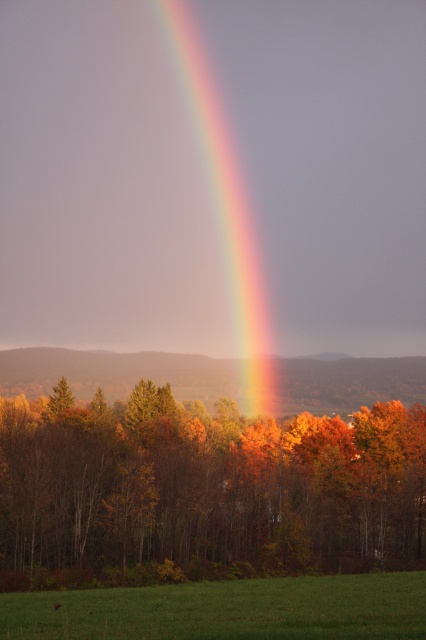
Is autumn leaves at center above rainbow at center?

Incorrect, autumn leaves at center is not positioned above rainbow at center.

Between point (414, 410) and point (210, 163), which one is positioned behind?

Point (210, 163)

Which is in front, point (129, 582) or point (247, 232)?

Point (129, 582) is more forward.

I want to click on autumn leaves at center, so click(203, 490).

In the scene shown: Does green grass at lower center come behind rainbow at center?

That is False.

This screenshot has width=426, height=640. Identify the location of green grass at lower center. (227, 609).

At what (x,y) coordinates should I click in order to perform the action: click on green grass at lower center. Please return your answer as a coordinate pair (x, y). Looking at the image, I should click on (227, 609).

The image size is (426, 640). Describe the element at coordinates (203, 490) in the screenshot. I see `autumn leaves at center` at that location.

Identify the location of autumn leaves at center. This screenshot has height=640, width=426. (203, 490).